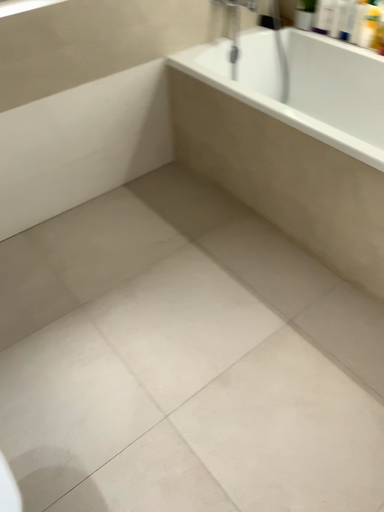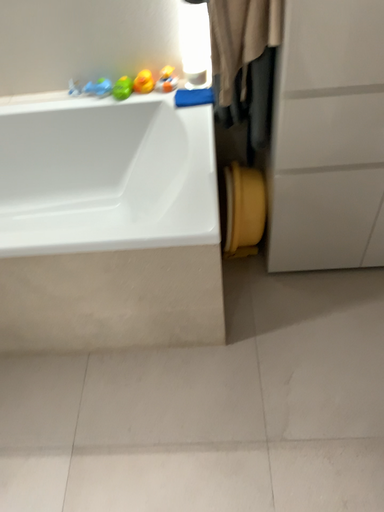
Question: Which way did the camera rotate in the video?

Choices:
 (A) rotated upward
 (B) rotated downward

Answer: (A)